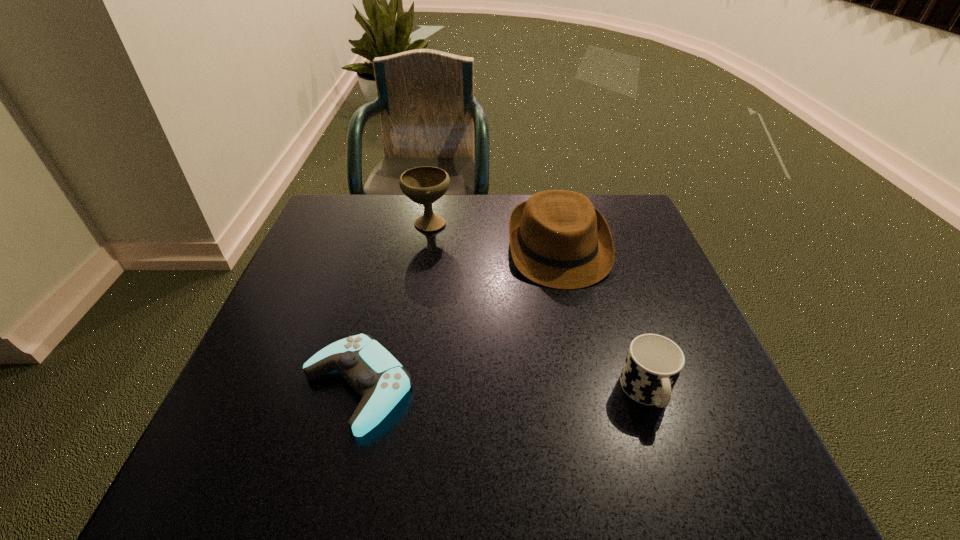
Where is `unoccupied area between the fedora and the cup`? This screenshot has height=540, width=960. unoccupied area between the fedora and the cup is located at coordinates (603, 320).

Select which object is the closest to the third tallest object. Please provide its 2D coordinates. Your answer should be formatted as a tuple, i.e. [(x, y)], where the tuple contains the x and y coordinates of a point satisfying the conditions above.

[(558, 239)]

Identify which object is located as the third nearest to the shortest object. Please provide its 2D coordinates. Your answer should be formatted as a tuple, i.e. [(x, y)], where the tuple contains the x and y coordinates of a point satisfying the conditions above.

[(653, 364)]

At what (x,y) coordinates should I click in order to perform the action: click on free space that satisfies the following two spatial constraints: 1. on the back side of the shortest object; 2. on the right side of the chalice. Please return your answer as a coordinate pair (x, y). This screenshot has height=540, width=960. Looking at the image, I should click on (398, 222).